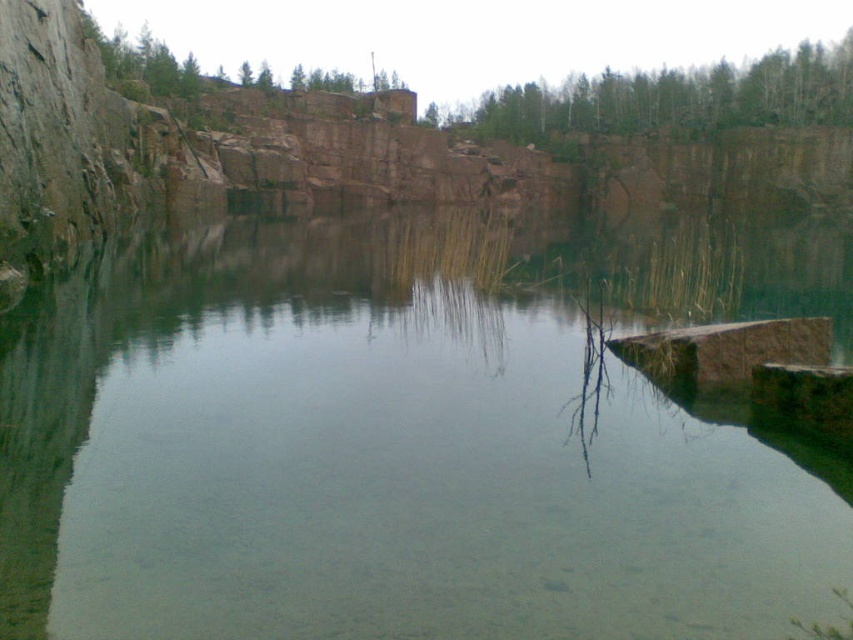
Between clear water at center and green leafy trees at upper center, which one is positioned lower?

clear water at center is lower down.

The height and width of the screenshot is (640, 853). Describe the element at coordinates (405, 435) in the screenshot. I see `clear water at center` at that location.

Locate an element on the screen. clear water at center is located at coordinates (405, 435).